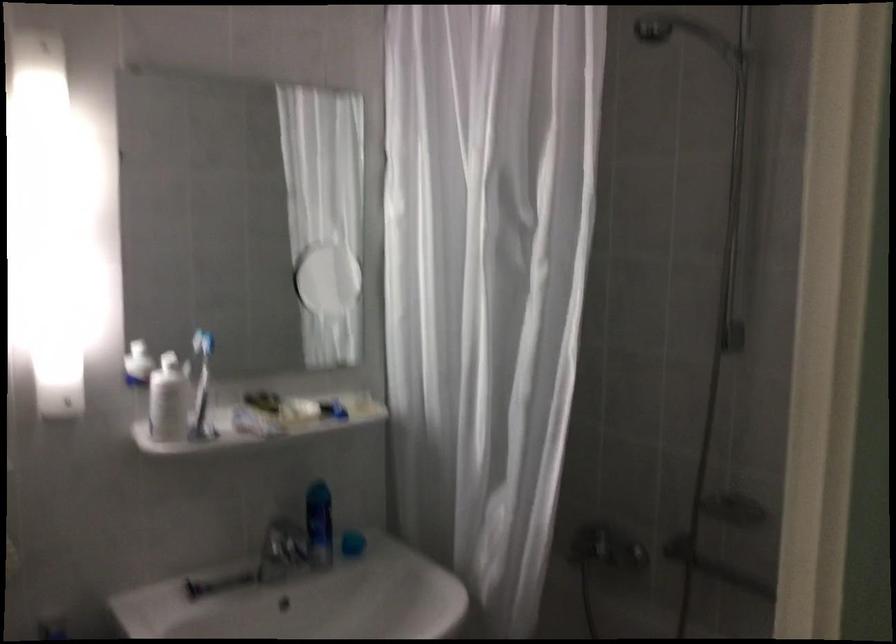
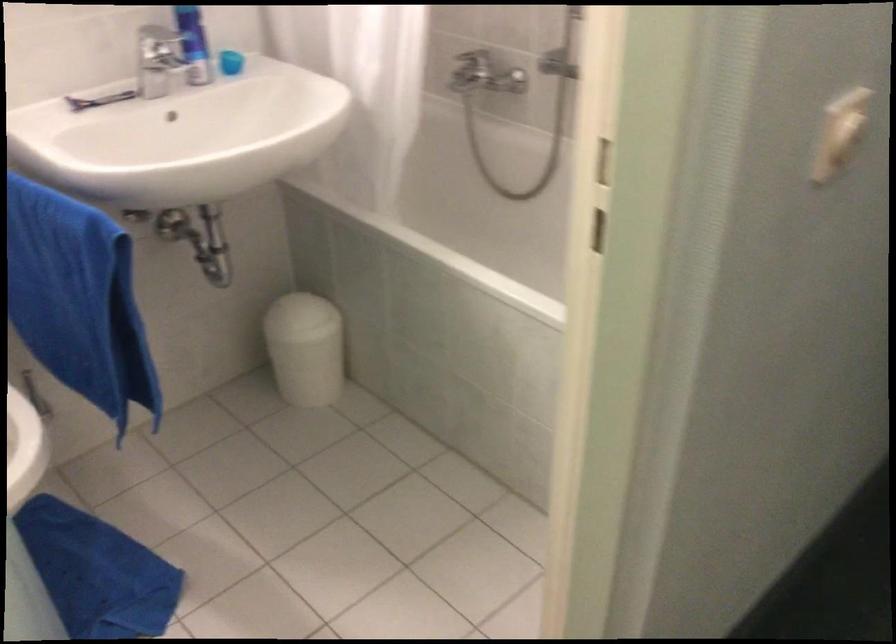
The point at (317, 529) is marked in the first image. Where is the corresponding point in the second image?

(194, 44)